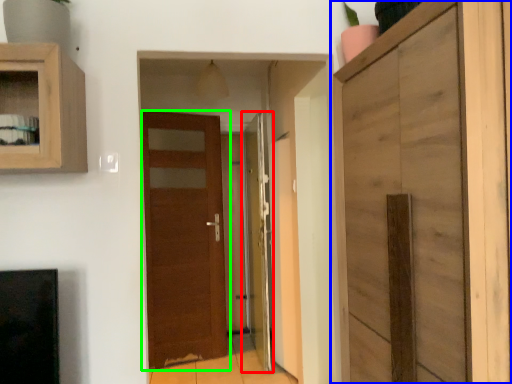
Question: Which is farther away from door (highlighted by a red box)? cupboard (highlighted by a blue box) or door (highlighted by a green box)?

Choices:
 (A) cupboard
 (B) door

Answer: (A)